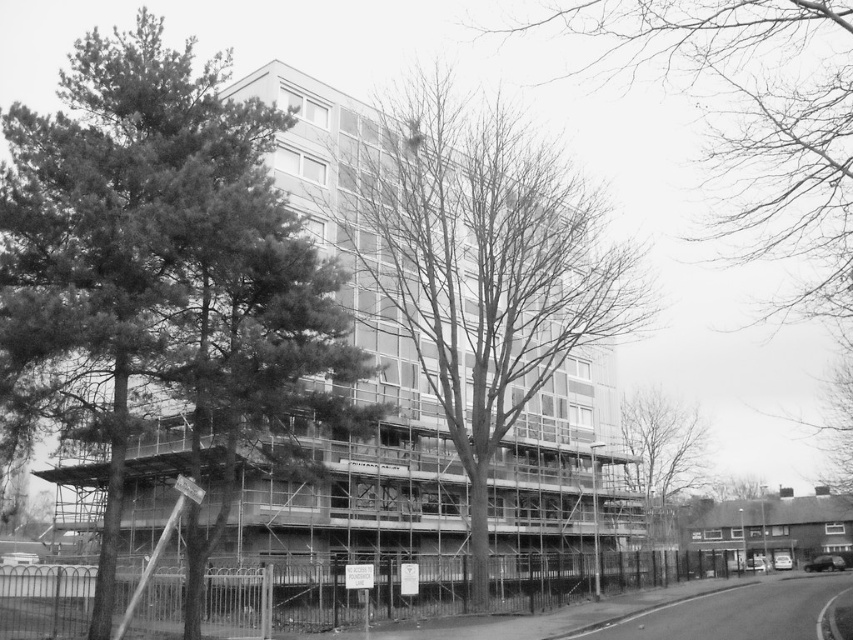
Question: Does green leafy tree at left appear over bare branches at lower right?

Choices:
 (A) yes
 (B) no

Answer: (A)

Question: Which of the following is the closest to the observer?

Choices:
 (A) bare branches at lower right
 (B) green leafy tree at left
 (C) bare branches at upper center
 (D) bare branches at center

Answer: (C)

Question: Considering the relative positions of bare branches at center and bare branches at upper center in the image provided, where is bare branches at center located with respect to bare branches at upper center?

Choices:
 (A) left
 (B) right

Answer: (A)

Question: Which point is closer to the camera?

Choices:
 (A) bare branches at lower right
 (B) bare branches at upper center
 (C) green leafy tree at left
 (D) bare branches at center

Answer: (B)

Question: Is bare branches at upper center further to the viewer compared to bare branches at lower right?

Choices:
 (A) yes
 (B) no

Answer: (B)

Question: Among these objects, which one is nearest to the camera?

Choices:
 (A) green leafy tree at left
 (B) bare branches at lower right
 (C) bare branches at upper center

Answer: (C)